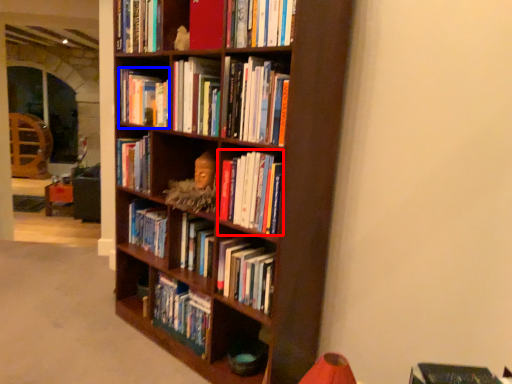
Question: Which object appears farthest to the camera in this image, book (highlighted by a red box) or book (highlighted by a blue box)?

Choices:
 (A) book
 (B) book

Answer: (B)